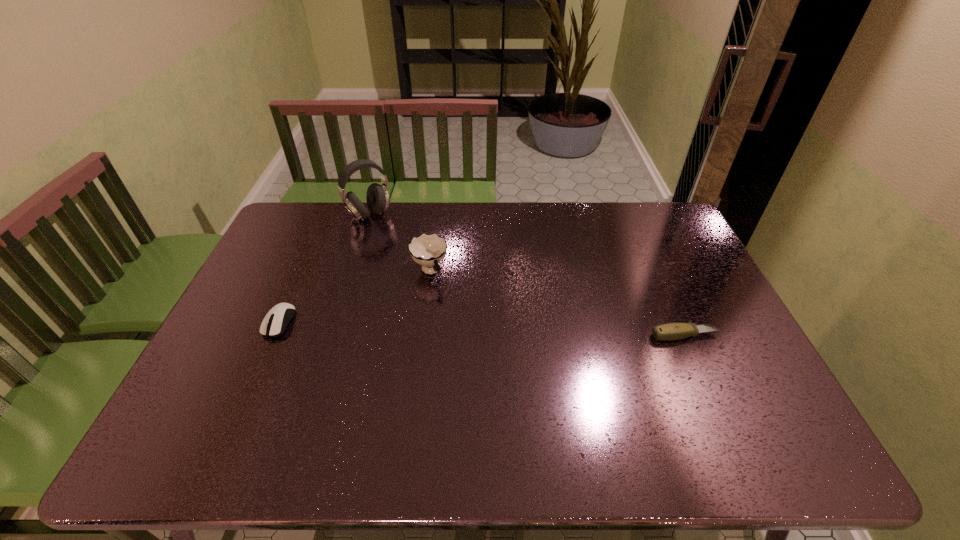
Where is `vacant region at the near edge of the desktop`? Image resolution: width=960 pixels, height=540 pixels. vacant region at the near edge of the desktop is located at coordinates (610, 401).

In the image, there is a desktop. Identify the location of vacant space at the left edge. This screenshot has width=960, height=540. (248, 296).

I want to click on free region at the right edge, so click(x=692, y=273).

You are a GUI agent. You are given a task and a screenshot of the screen. Output one action in this format:
    pyautogui.click(x=<x>, y=<y>)
    Task: Click on the vacant space at the near left corner
    The width and height of the screenshot is (960, 540).
    Given the screenshot: What is the action you would take?
    [208, 388]

Where is `free space between the third tallest object and the shortest object`? free space between the third tallest object and the shortest object is located at coordinates (482, 329).

The width and height of the screenshot is (960, 540). Find the location of `unoccupied position between the third nearest object and the third object from right to left`. unoccupied position between the third nearest object and the third object from right to left is located at coordinates (399, 243).

The height and width of the screenshot is (540, 960). What are the coordinates of `blank region between the shortest object and the second farthest object` in the screenshot? It's located at (558, 303).

This screenshot has height=540, width=960. In order to click on vacant region between the pocketknife and the second object from left to right in this screenshot , I will do `click(527, 275)`.

The height and width of the screenshot is (540, 960). In order to click on free space between the second shortest object and the second object from left to right in this screenshot , I will do `click(324, 268)`.

Where is `unoccupied area between the second object from right to left and the headset`? The height and width of the screenshot is (540, 960). unoccupied area between the second object from right to left and the headset is located at coordinates (399, 243).